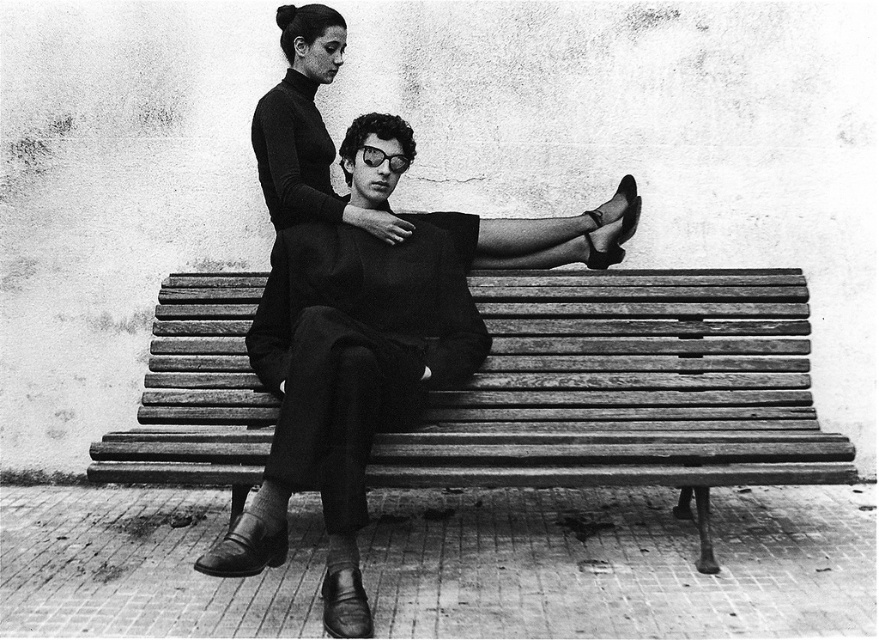
Measure the distance between wooden bench at center and smooth leather jacket at center.

wooden bench at center and smooth leather jacket at center are 17.57 inches apart from each other.

You are a GUI agent. You are given a task and a screenshot of the screen. Output one action in this format:
    pyautogui.click(x=<x>, y=<y>)
    Task: Click on the wooden bench at center
    The width and height of the screenshot is (879, 640).
    Given the screenshot: What is the action you would take?
    pyautogui.click(x=630, y=388)

What do you see at coordinates (630, 388) in the screenshot?
I see `wooden bench at center` at bounding box center [630, 388].

Locate an element on the screen. wooden bench at center is located at coordinates (630, 388).